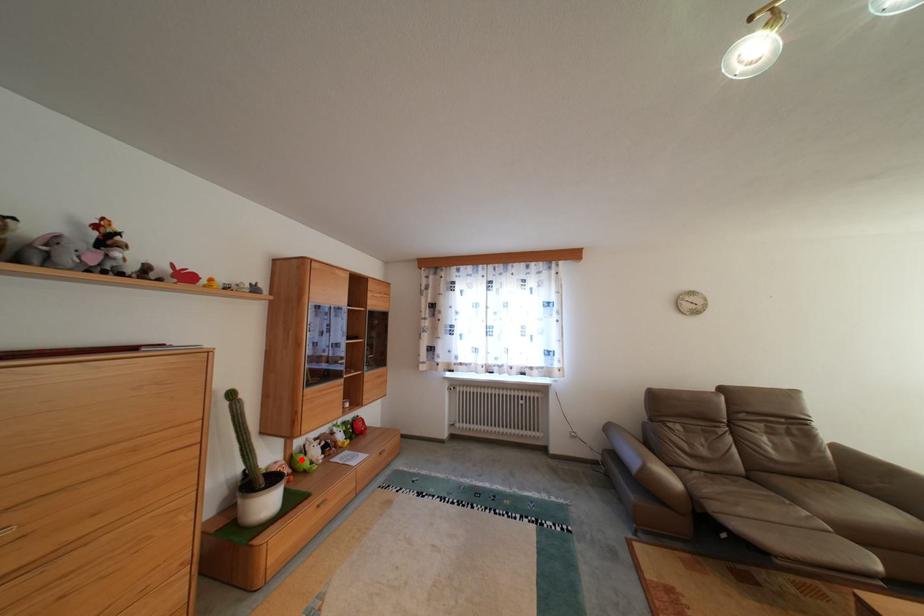
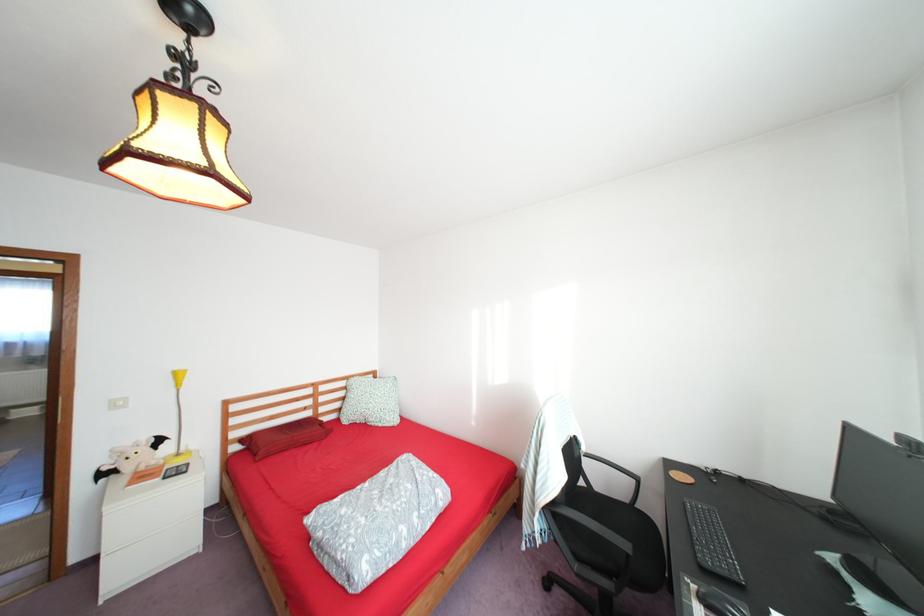
Question: I am providing you with two images of the same scene from different viewpoints. A red point is marked on the first image. At the location where the point appears in image 1, is it still visible in image 2?

Choices:
 (A) Yes
 (B) No

Answer: (B)